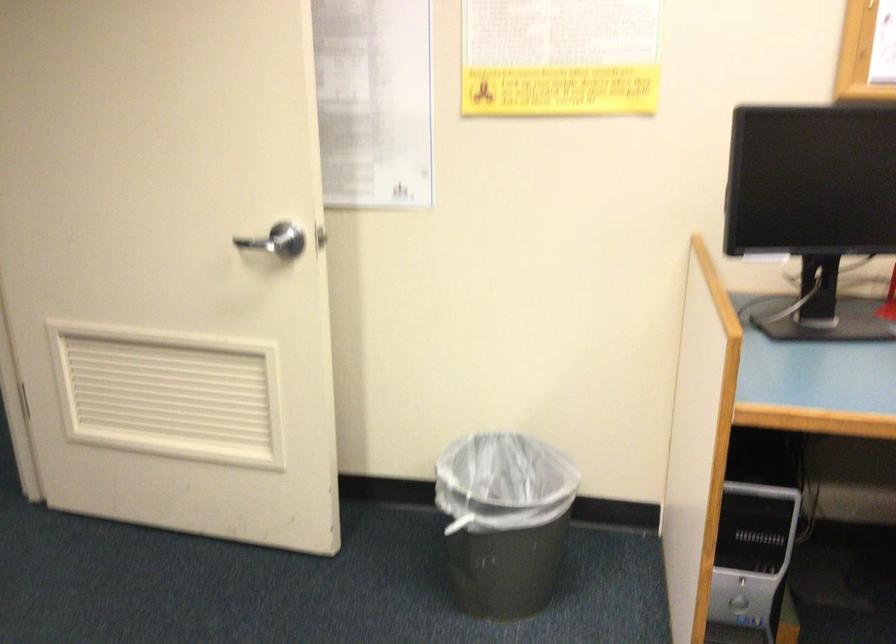
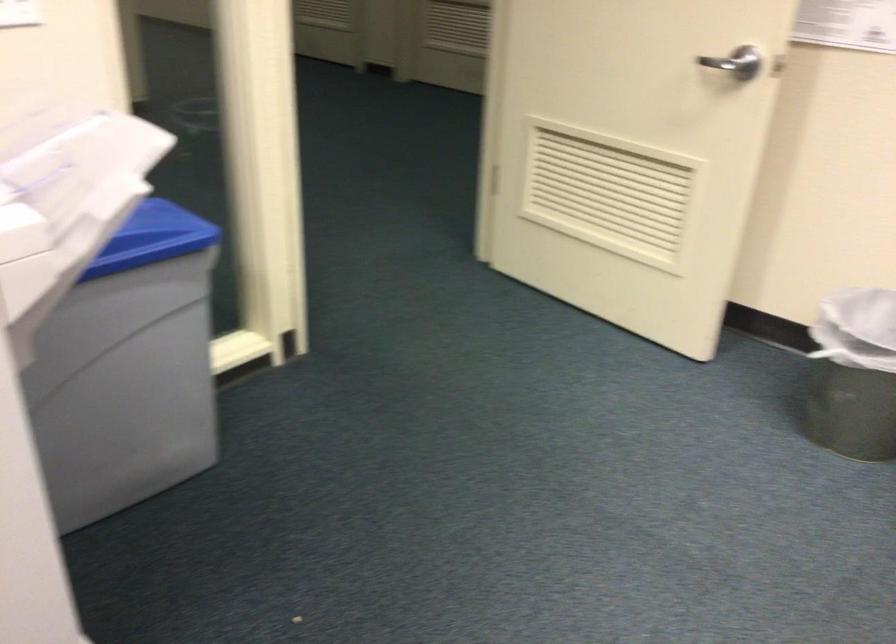
Locate, in the second image, the point that corresponds to (x=276, y=243) in the first image.

(736, 62)